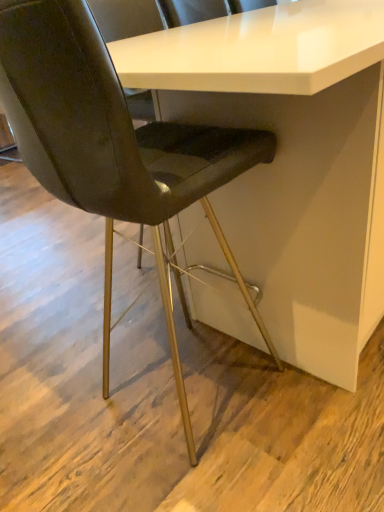
Describe the element at coordinates (113, 148) in the screenshot. This screenshot has width=384, height=512. I see `leather-like black chair at center` at that location.

Find the location of `leather-like black chair at center`. leather-like black chair at center is located at coordinates click(113, 148).

Where is `leather-like black chair at center`? This screenshot has width=384, height=512. leather-like black chair at center is located at coordinates (113, 148).